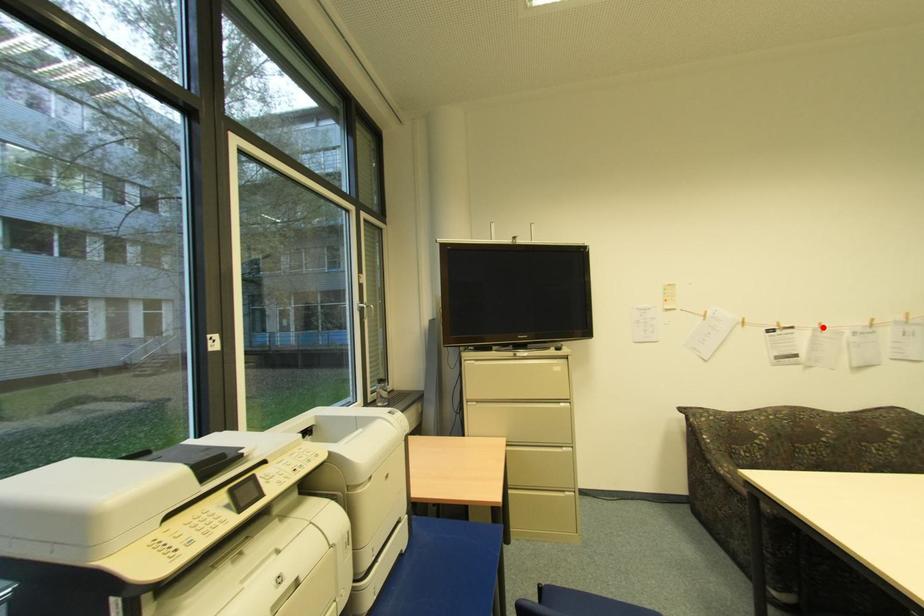
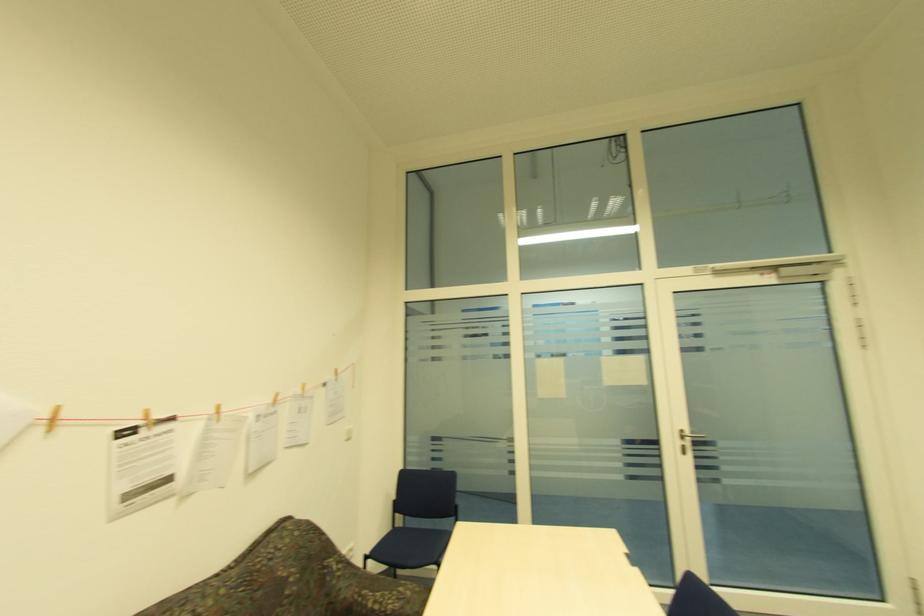
Where in the second image is the point corresponding to the highlighted location from the first image?

(219, 413)